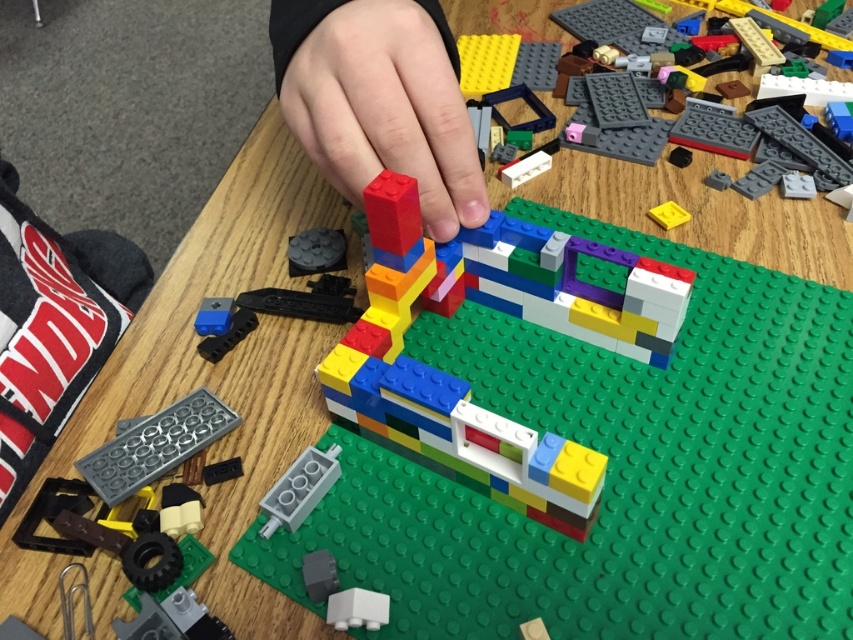
Question: Is matte plastic hand at center smaller than translucent plastic brick at center?

Choices:
 (A) yes
 (B) no

Answer: (A)

Question: Does matte plastic hand at center appear on the left side of translucent plastic brick at center?

Choices:
 (A) yes
 (B) no

Answer: (A)

Question: Where is matte plastic hand at center located in relation to translucent plastic brick at center in the image?

Choices:
 (A) left
 (B) right

Answer: (A)

Question: Which object is farther from the camera taking this photo?

Choices:
 (A) matte plastic hand at center
 (B) translucent plastic brick at center

Answer: (B)